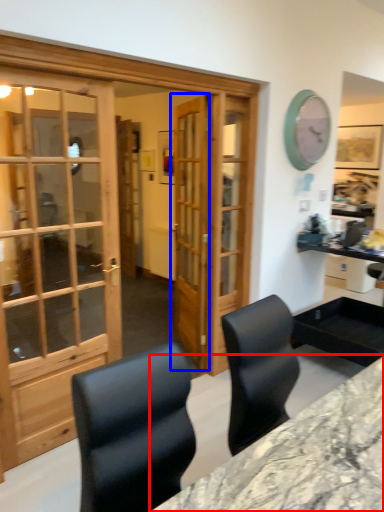
Question: Which of the following is the closest to the observer, desk (highlighted by a red box) or door (highlighted by a blue box)?

Choices:
 (A) desk
 (B) door

Answer: (A)